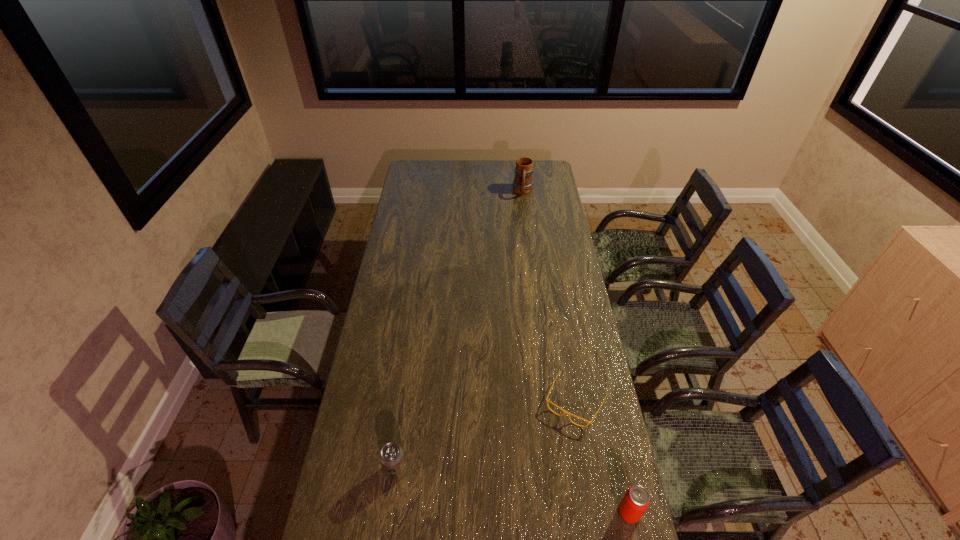
Where is `vacant space that satisfies the following two spatial constraints: 1. on the front side of the farthest object; 2. on the right side of the shortest object`? vacant space that satisfies the following two spatial constraints: 1. on the front side of the farthest object; 2. on the right side of the shortest object is located at coordinates (549, 402).